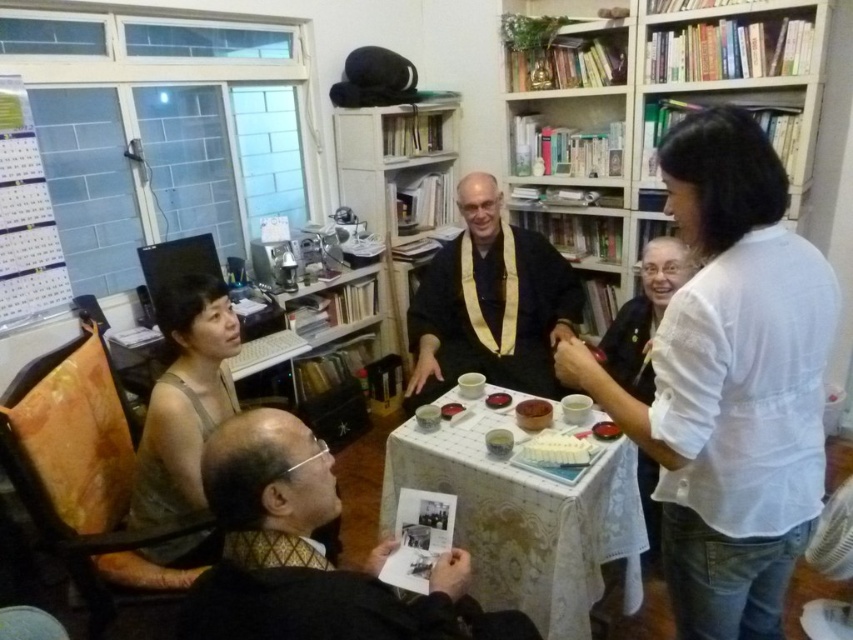
Is black textured jacket at lower left to the right of white lace tablecloth at center from the viewer's perspective?

No, black textured jacket at lower left is not to the right of white lace tablecloth at center.

Can you confirm if black textured jacket at lower left is thinner than white lace tablecloth at center?

Correct, black textured jacket at lower left's width is less than white lace tablecloth at center's.

In order to click on black textured jacket at lower left in this screenshot , I will do `click(309, 554)`.

In the scene shown: Is white textured blouse at upper right thinner than matte brown tank top at left?

In fact, white textured blouse at upper right might be wider than matte brown tank top at left.

Can you confirm if white textured blouse at upper right is positioned to the right of matte brown tank top at left?

Yes, white textured blouse at upper right is to the right of matte brown tank top at left.

What do you see at coordinates (730, 381) in the screenshot?
I see `white textured blouse at upper right` at bounding box center [730, 381].

I want to click on white textured blouse at upper right, so click(x=730, y=381).

Is wooden bookshelf at center to the right of white cotton blouse at upper right from the viewer's perspective?

Incorrect, wooden bookshelf at center is not on the right side of white cotton blouse at upper right.

Consider the image. Between wooden bookshelf at center and white cotton blouse at upper right, which one is positioned lower?

white cotton blouse at upper right

Where is `wooden bookshelf at center`? wooden bookshelf at center is located at coordinates (398, 188).

Where is `wooden bookshelf at center`? This screenshot has height=640, width=853. wooden bookshelf at center is located at coordinates (398, 188).